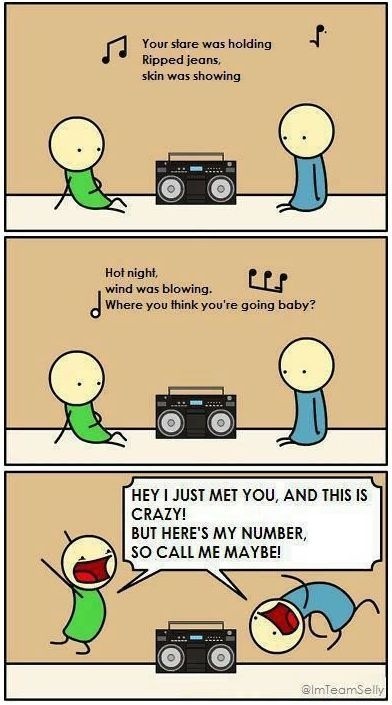
You are a GUI agent. You are given a task and a screenshot of the screen. Output one action in this format:
    pyautogui.click(x=<x>, y=<y>)
    Task: Click on the wall
    The height and width of the screenshot is (705, 392).
    Given the screenshot: What is the action you would take?
    pyautogui.click(x=79, y=521), pyautogui.click(x=153, y=329), pyautogui.click(x=67, y=73)